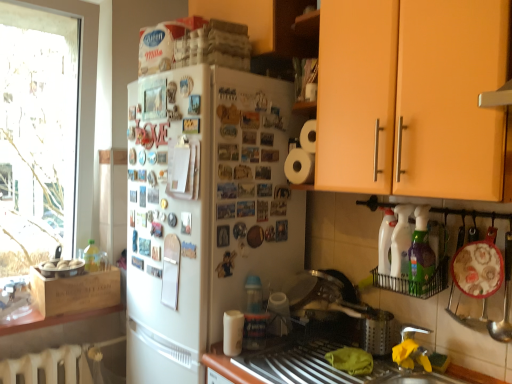
Question: In terms of height, does metallic silver sink at lower center look taller or shorter compared to white matte refrigerator at center?

Choices:
 (A) short
 (B) tall

Answer: (A)

Question: Which is correct: metallic silver sink at lower center is inside white matte refrigerator at center, or outside of it?

Choices:
 (A) inside
 (B) outside

Answer: (B)

Question: Based on their relative distances, which object is nearer to the white matte paper towel at lower center?

Choices:
 (A) silver metallic faucet at lower right
 (B) metallic silver sink at lower center
 (C) white glossy bottle at right, which is counted as the 2th bottle, starting from the front
 (D) orange matte cabinet at upper right
 (E) white matte refrigerator at center

Answer: (B)

Question: Estimate the real-world distances between objects in this image. Which object is closer to the transparent glass window at left?

Choices:
 (A) orange matte cabinet at upper right
 (B) green plastic bottle at lower right, the 2th bottle viewed from the back
 (C) metallic silver sink at lower center
 (D) silver metallic sink at lower right
 (E) white matte refrigerator at center

Answer: (E)